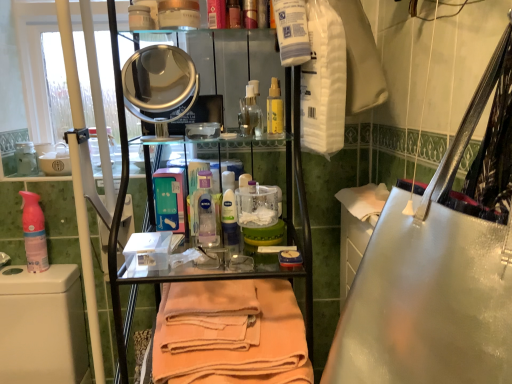
At what (x,y) coordinates should I click in order to perform the action: click on space that is in front of pink matte spray can at left, the 2th cleaning product viewed from the right. Please return your answer as a coordinate pair (x, y). Image resolution: width=512 pixels, height=384 pixels. Looking at the image, I should click on (26, 277).